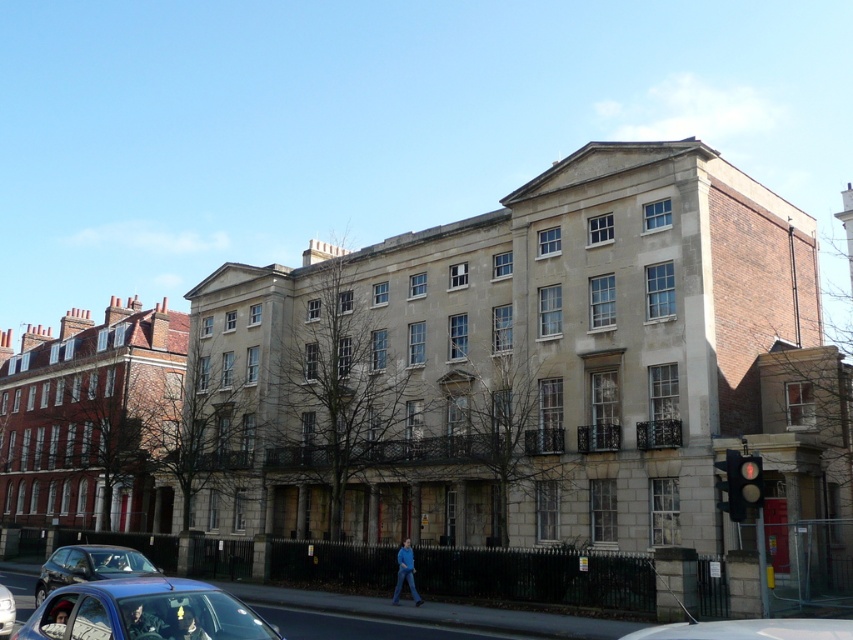
You are standing at the entrance of the building and want to cross the street. The traffic light is at the right side. Where exactly is the metallic traffic light at right located in relation to the building?

The metallic traffic light at right is located at point [740,483], which is to the right side of the building.